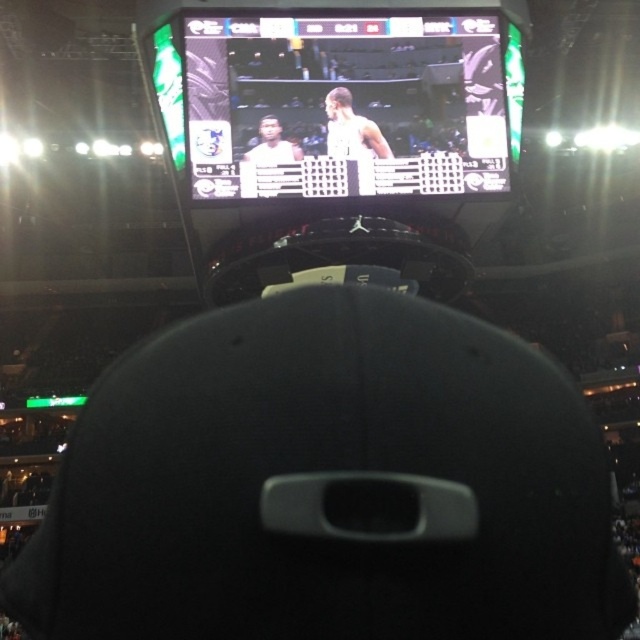
Does black matte baseball cap at center have a greater height compared to matte black screen at upper center?

Indeed, black matte baseball cap at center has a greater height compared to matte black screen at upper center.

In order to click on black matte baseball cap at center in this screenshot , I will do `click(326, 484)`.

Image resolution: width=640 pixels, height=640 pixels. What do you see at coordinates (326, 484) in the screenshot? I see `black matte baseball cap at center` at bounding box center [326, 484].

The width and height of the screenshot is (640, 640). I want to click on black matte baseball cap at center, so [x=326, y=484].

Can you confirm if white matte basketball player at center is smaller than matte white jersey at center?

No, white matte basketball player at center is not smaller than matte white jersey at center.

Is the position of white matte basketball player at center more distant than that of matte white jersey at center?

That is True.

Find the location of a particular element. white matte basketball player at center is located at coordinates (352, 129).

Between matte black screen at upper center and matte white jersey at center, which one appears on the right side from the viewer's perspective?

From the viewer's perspective, matte black screen at upper center appears more on the right side.

Locate an element on the screen. This screenshot has height=640, width=640. matte black screen at upper center is located at coordinates (353, 104).

The width and height of the screenshot is (640, 640). I want to click on matte black screen at upper center, so click(x=353, y=104).